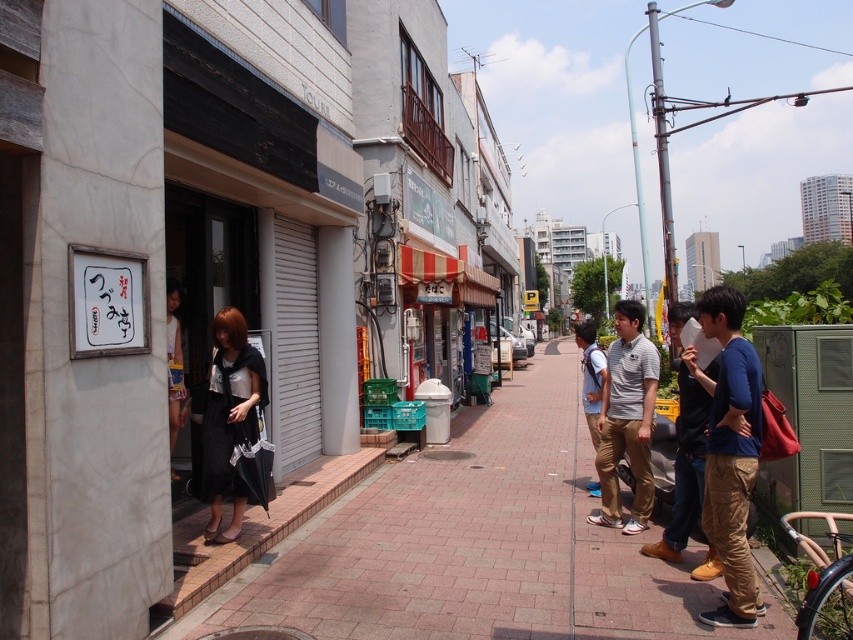
From the picture: Does black matte dress at center have a lesser height compared to blue jeans at center?

Indeed, black matte dress at center has a lesser height compared to blue jeans at center.

Measure the distance between point (207, 502) and camera.

A distance of 17.96 feet exists between point (207, 502) and camera.

Is point (233, 400) positioned before point (694, 385)?

No, it is behind (694, 385).

The image size is (853, 640). What are the coordinates of `black matte dress at center` in the screenshot? It's located at (230, 420).

Measure the distance from blue cotton shirt at right to gray cotton polo shirt at center.

They are 5.29 feet apart.

Does blue cotton shirt at right appear over gray cotton polo shirt at center?

No, blue cotton shirt at right is not above gray cotton polo shirt at center.

This screenshot has height=640, width=853. In order to click on blue cotton shirt at right in this screenshot , I will do `click(730, 456)`.

Who is higher up, black matte dress at center or white cotton dress at left?

Positioned higher is white cotton dress at left.

Who is shorter, black matte dress at center or white cotton dress at left?

white cotton dress at left

Where is `black matte dress at center`? This screenshot has height=640, width=853. black matte dress at center is located at coordinates (230, 420).